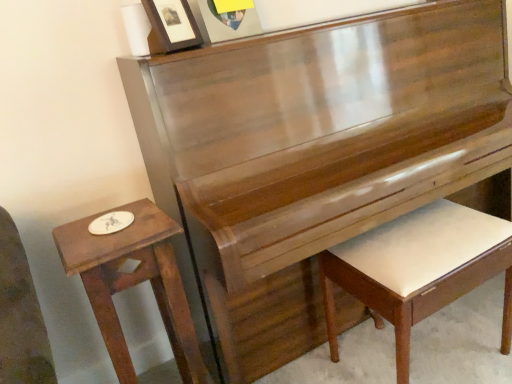
Where is `free space to the right of matte black picture frame at upper center, arranged as the 1th picture frame when viewed from the left`? This screenshot has width=512, height=384. free space to the right of matte black picture frame at upper center, arranged as the 1th picture frame when viewed from the left is located at coordinates (218, 40).